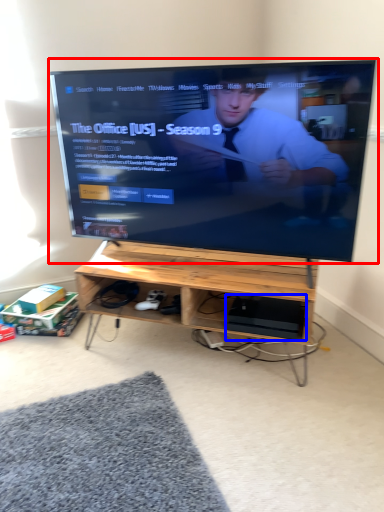
Question: Which point is closer to the camera, television (highlighted by a red box) or computer (highlighted by a blue box)?

Choices:
 (A) television
 (B) computer

Answer: (A)